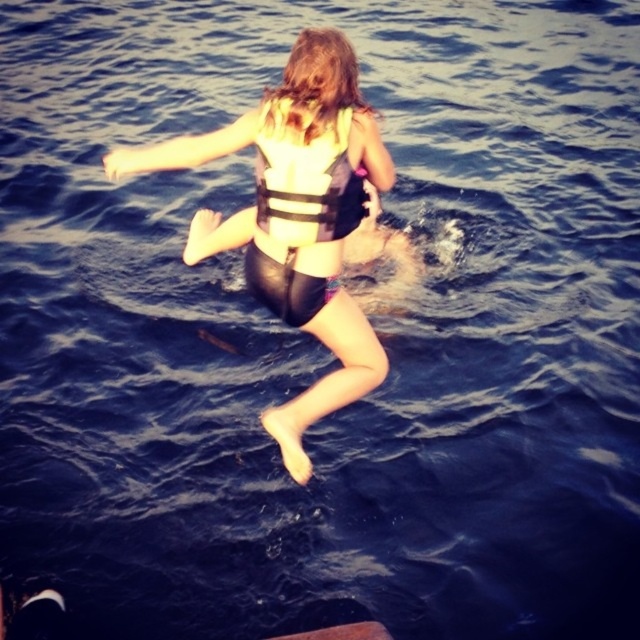
Consider the image. You are a lifeguard observing a diver from above. You notice two items at the center of the image. Which one is closer to you, the matte black swimsuit at center or the yellow fabric life jacket at center?

The matte black swimsuit at center is closer to you because it is positioned in front of the yellow fabric life jacket at center.

You are a photographer trying to capture the perfect shot of the diver. Since you want to highlight both the matte black swimsuit at center and the yellow fabric life jacket at center, which one should you focus on first if you want to ensure both are in the frame?

The matte black swimsuit at center is taller than the yellow fabric life jacket at center, so focusing on the matte black swimsuit at center first will ensure the yellow fabric life jacket at center is also in the frame.

You are a photographer analyzing the composition of this image. The subject is diving into water. You need to ensure the matte black swimsuit at center is centered in the frame. According to the coordinates provided, is the swimsuit perfectly centered horizontally and vertically?

The coordinates of the matte black swimsuit at center are at point (296, 218), which means it is not perfectly centered in the frame both horizontally and vertically.